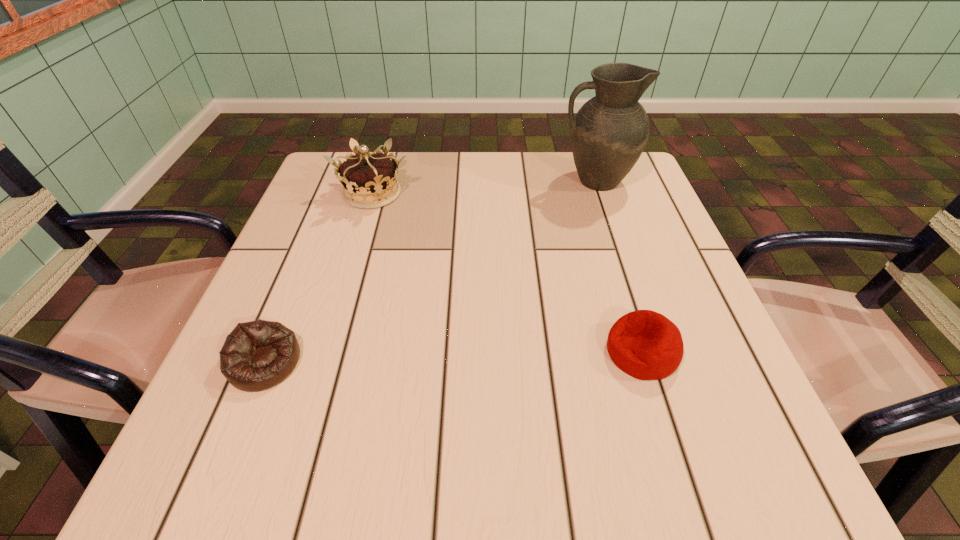
Locate an element on the screen. The image size is (960, 540). object that is the second closest one to the crown is located at coordinates (610, 131).